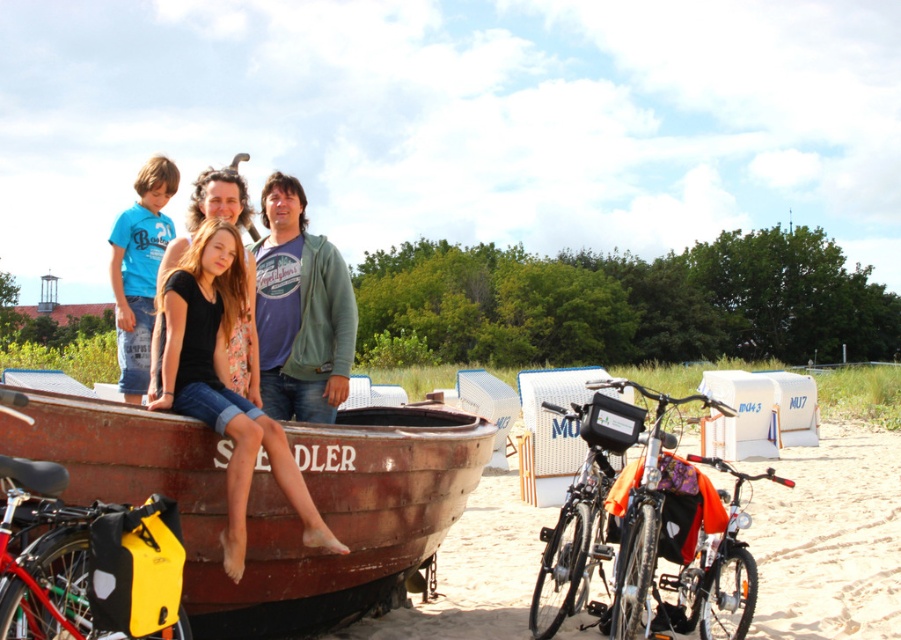
Question: Which is nearer to the matte black shirt at center?

Choices:
 (A) shiny metallic bicycle at lower right
 (B) green cotton hoodie at center

Answer: (B)

Question: Can you confirm if rusty wooden boat at center is smaller than green cotton hoodie at center?

Choices:
 (A) no
 (B) yes

Answer: (A)

Question: Does matte black shirt at center appear over green cotton hoodie at center?

Choices:
 (A) no
 (B) yes

Answer: (A)

Question: Among these objects, which one is nearest to the camera?

Choices:
 (A) matte green hoodie at center
 (B) matte black shirt at center

Answer: (B)

Question: Is green cotton hoodie at center closer to camera compared to shiny metallic bicycle at center?

Choices:
 (A) no
 (B) yes

Answer: (A)

Question: Among these objects, which one is nearest to the camera?

Choices:
 (A) matte green hoodie at center
 (B) rusty wooden boat at center

Answer: (B)